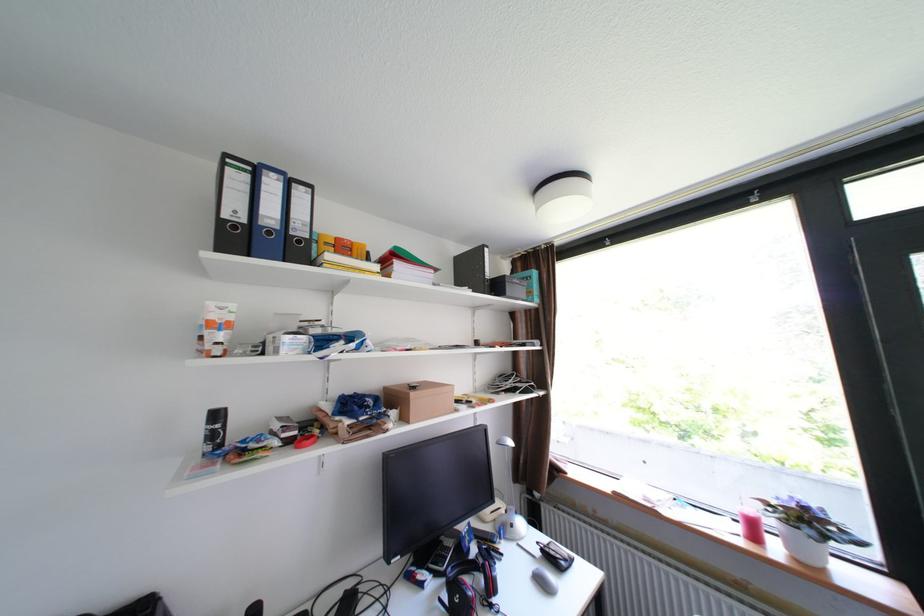
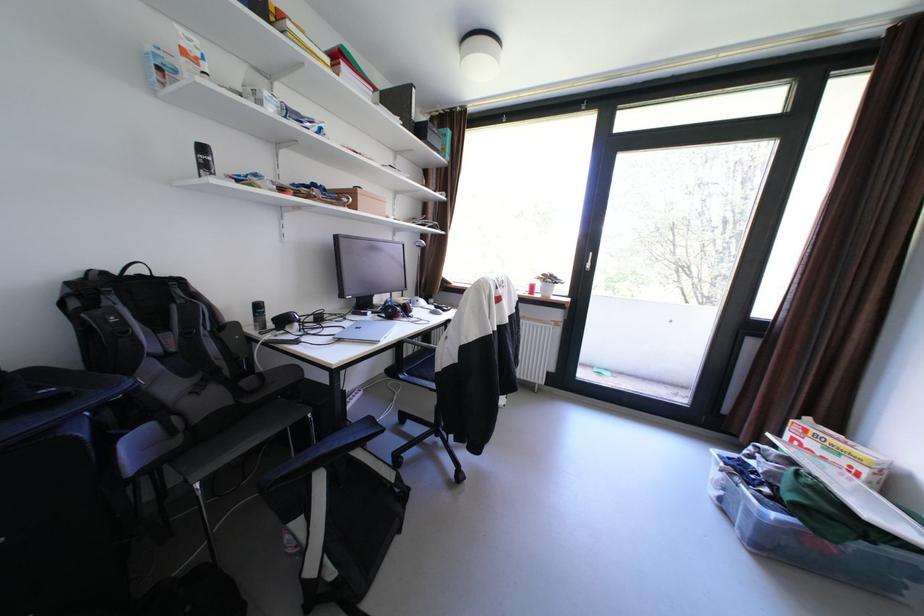
Where in the second image is the point corresponding to point (552, 583) from the first image?

(444, 314)